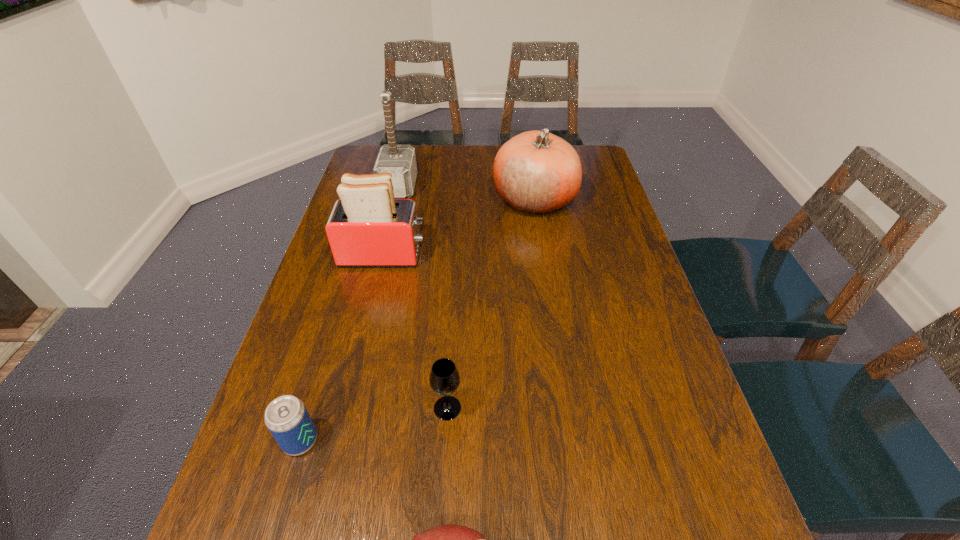
This screenshot has width=960, height=540. I want to click on hammer, so click(398, 159).

The image size is (960, 540). In order to click on pumpkin in this screenshot , I will do `click(536, 172)`.

Find the location of a particular element. the third farthest object is located at coordinates (367, 227).

Find the location of a particular element. The height and width of the screenshot is (540, 960). wineglass is located at coordinates pos(444,379).

At what (x,y) coordinates should I click in order to perform the action: click on the third shortest object. Please return your answer as a coordinate pair (x, y). The width and height of the screenshot is (960, 540). Looking at the image, I should click on (444, 379).

Locate an element on the screen. This screenshot has width=960, height=540. the second nearest object is located at coordinates (286, 417).

Identify the location of the fifth tallest object. (286, 417).

Locate an element on the screen. The width and height of the screenshot is (960, 540). free location located for striking with the head of the tallest object is located at coordinates (437, 187).

This screenshot has height=540, width=960. Find the location of `vacant space located on the left of the pumpkin`. vacant space located on the left of the pumpkin is located at coordinates (444, 199).

Locate an element on the screen. Image resolution: width=960 pixels, height=540 pixels. free region located on the front-facing side of the third farthest object is located at coordinates (548, 255).